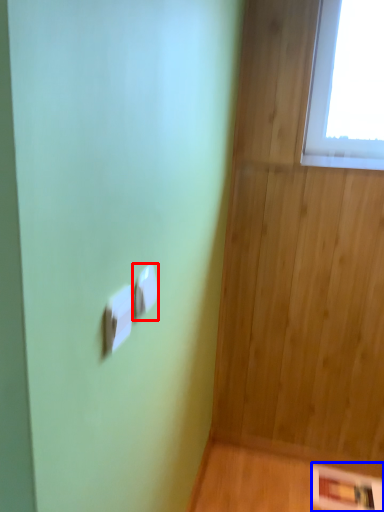
Question: Which of the following is the closest to the observer, light switch (highlighted by a red box) or panel (highlighted by a blue box)?

Choices:
 (A) light switch
 (B) panel

Answer: (A)